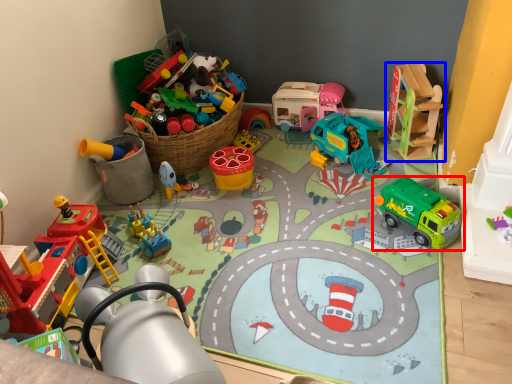
Question: Among these objects, which one is farthest to the camera, toy (highlighted by a red box) or toy (highlighted by a blue box)?

Choices:
 (A) toy
 (B) toy

Answer: (B)